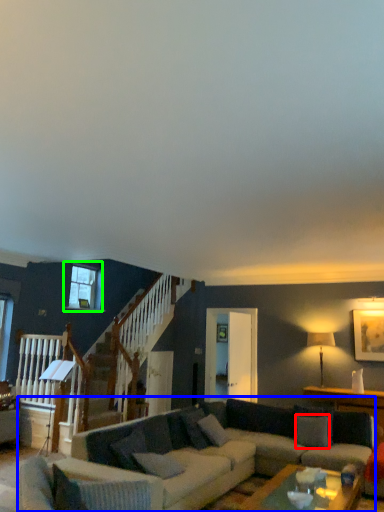
Question: Considering the real-world distances, which object is farthest from pillow (highlighted by a red box)? studio couch (highlighted by a blue box) or window (highlighted by a green box)?

Choices:
 (A) studio couch
 (B) window

Answer: (B)